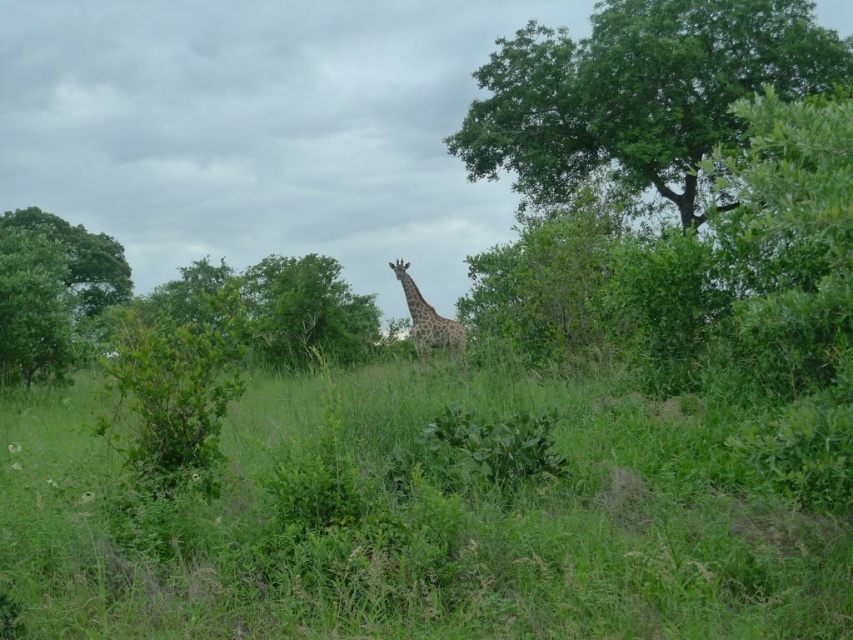
You are a photographer trying to capture a closeup of the giraffe. You notice two points in the scene marked as point 1 and point 2. Point 1 is at coordinates point (703, 144) and point 2 is at coordinates point (20, 360). Which point is closer to the camera and thus better for focusing on the giraffe?

Point 1 at coordinates point (703, 144) is closer to the camera than point 2 at coordinates point (20, 360), so it would be better for focusing on the giraffe.

In the scene, there is a green leafy tree at left and a spotted fur giraffe at center. Which one is taller?

The green leafy tree at left is taller than the spotted fur giraffe at center.